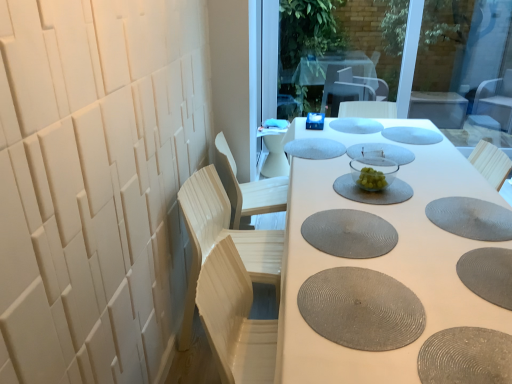
Where is `empty space that is to the right of clear glass bowl at center`? This screenshot has width=512, height=384. empty space that is to the right of clear glass bowl at center is located at coordinates (401, 183).